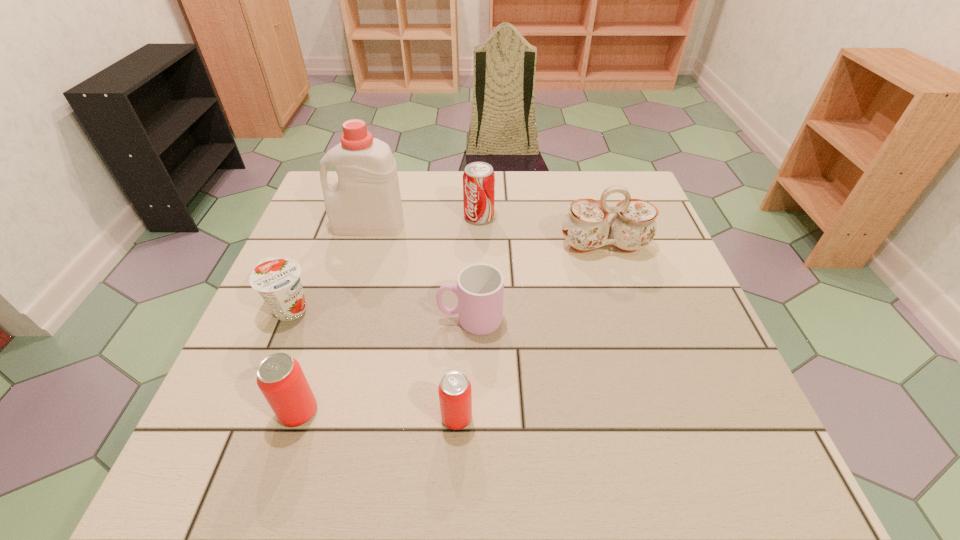
Where is `free space that satisfies the following two spatial constraints: 1. with the handle on the side of the cup; 2. on the handle side of the detergent`? The image size is (960, 540). free space that satisfies the following two spatial constraints: 1. with the handle on the side of the cup; 2. on the handle side of the detergent is located at coordinates (472, 226).

This screenshot has height=540, width=960. In order to click on vacant space that satisfies the following two spatial constraints: 1. with the handle on the side of the cup; 2. on the left side of the soda can in this screenshot , I will do `click(472, 217)`.